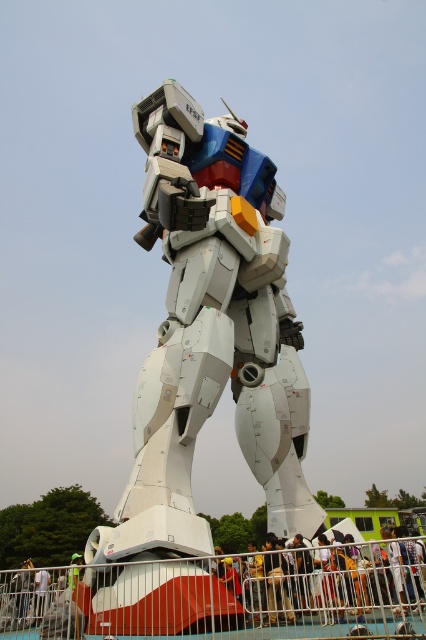
Question: Does white metallic robot at center have a lesser width compared to metal/rusty rail at lower center?

Choices:
 (A) yes
 (B) no

Answer: (A)

Question: Is metal/rusty rail at lower center wider than yellow fabric person at center?

Choices:
 (A) yes
 (B) no

Answer: (A)

Question: From the image, what is the correct spatial relationship of white metallic robot at center in relation to metal/rusty rail at lower center?

Choices:
 (A) right
 (B) left

Answer: (A)

Question: Which point is closer to the camera?

Choices:
 (A) (328, 552)
 (B) (207, 410)

Answer: (A)

Question: Considering the real-world distances, which object is farthest from the metal/rusty rail at lower center?

Choices:
 (A) white metallic robot at center
 (B) yellow fabric person at center

Answer: (A)

Question: Which point appears farthest from the camera in this image?

Choices:
 (A) (342, 611)
 (B) (241, 285)
 (C) (377, 588)

Answer: (B)